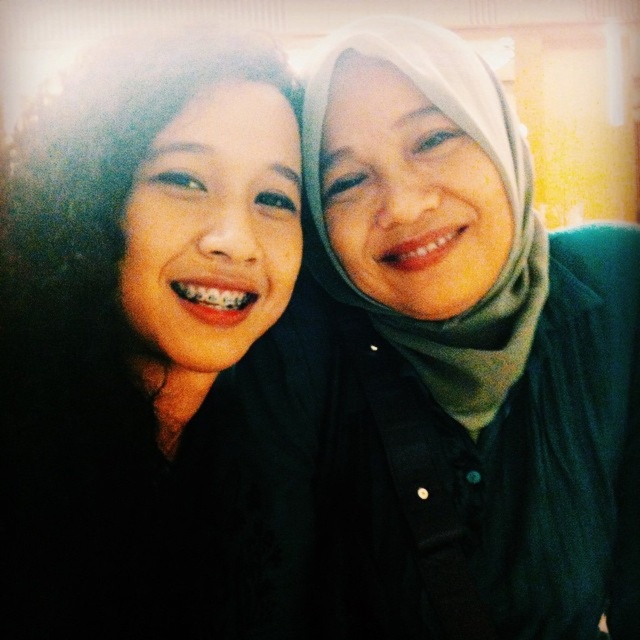
Between matte green hijab at upper right and matte black hijab at upper right, which one has more height?

Standing taller between the two is matte green hijab at upper right.

Between matte green hijab at upper right and matte black hijab at upper right, which one has less height?

matte black hijab at upper right is shorter.

Is point (413, 397) farther from viewer compared to point (104, 369)?

Yes, point (413, 397) is farther from viewer.

Image resolution: width=640 pixels, height=640 pixels. Identify the location of matte green hijab at upper right. (468, 353).